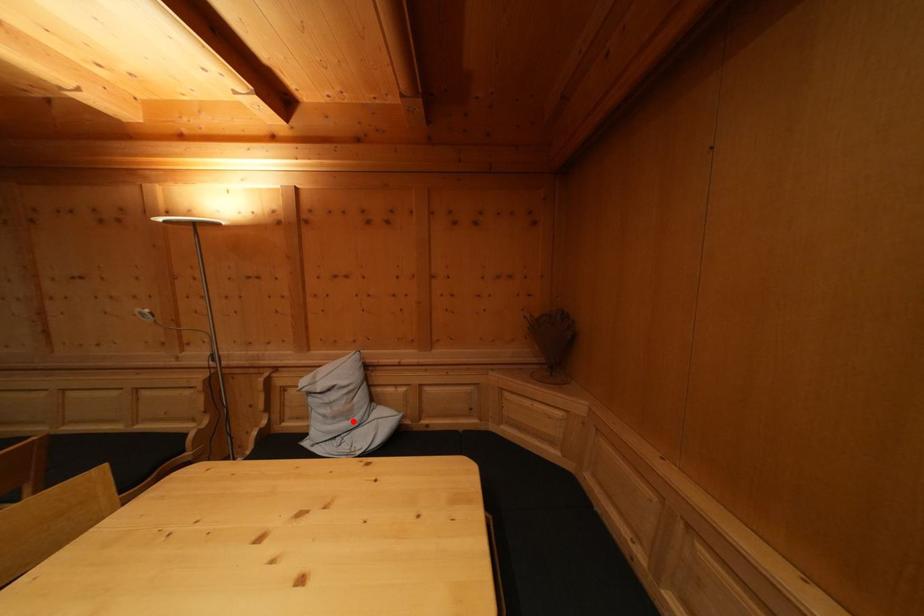
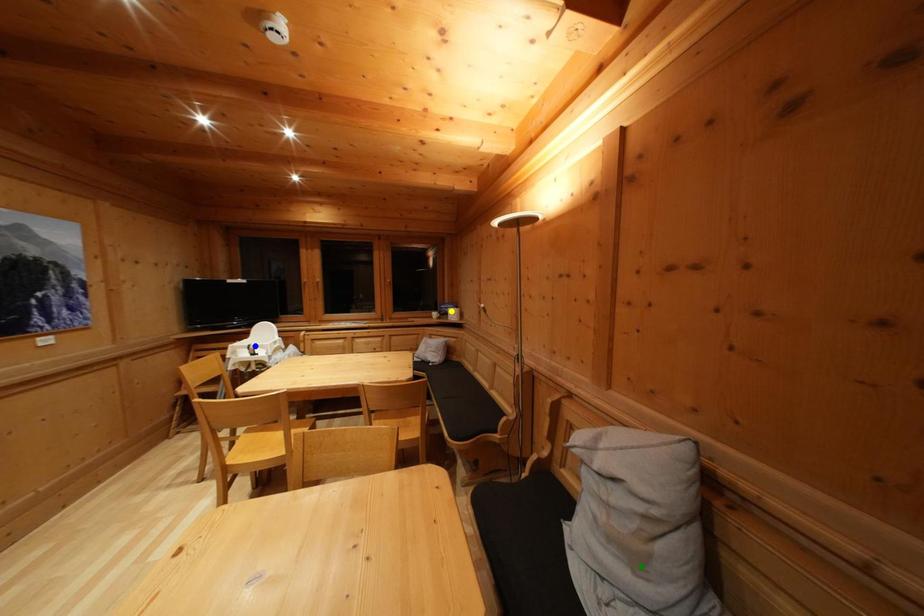
Question: I am providing you with two images of the same scene from different viewpoints. A red point is marked on the first image. You are given multiple points on the second image. In image 2, which mark is for the same physical point as the one in image 1?

Choices:
 (A) blue point
 (B) green point
 (C) yellow point

Answer: (B)